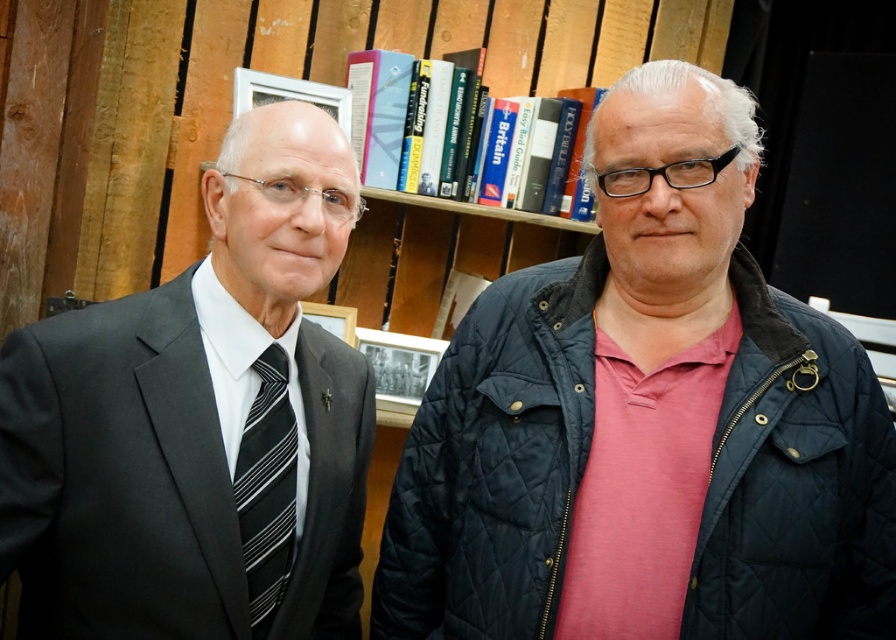
Is dark blue quilted jacket at right positioned before black striped tie at left?

No.

Does dark blue quilted jacket at right appear on the left side of black striped tie at left?

No, dark blue quilted jacket at right is not to the left of black striped tie at left.

Is point (738, 376) closer to viewer compared to point (263, 563)?

No, (738, 376) is further to viewer.

Where is `dark blue quilted jacket at right`? This screenshot has height=640, width=896. dark blue quilted jacket at right is located at coordinates (494, 464).

This screenshot has height=640, width=896. Find the location of `matte black suit at left`. matte black suit at left is located at coordinates (191, 420).

You are a GUI agent. You are given a task and a screenshot of the screen. Output one action in this format:
    pyautogui.click(x=<x>, y=<y>)
    Task: Click on the matte black suit at left
    
    Given the screenshot: What is the action you would take?
    pyautogui.click(x=191, y=420)

Can you confirm if matte black suit at left is positioned to the right of black striped tie at left?

Incorrect, matte black suit at left is not on the right side of black striped tie at left.

Can you confirm if matte black suit at left is shorter than black striped tie at left?

In fact, matte black suit at left may be taller than black striped tie at left.

Who is more forward, [343,621] or [290,548]?

Point [290,548]

Find the location of `matte black suit at left`. matte black suit at left is located at coordinates (191, 420).